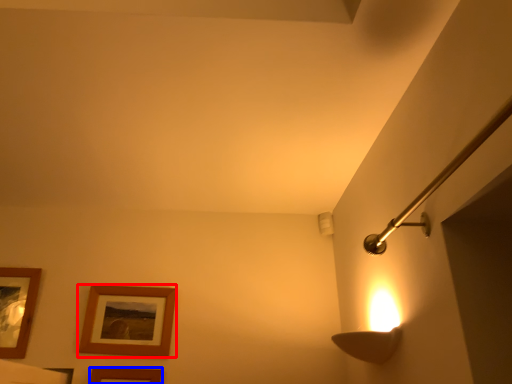
Question: Which point is closer to the camera, picture frame (highlighted by a red box) or picture frame (highlighted by a blue box)?

Choices:
 (A) picture frame
 (B) picture frame

Answer: (B)